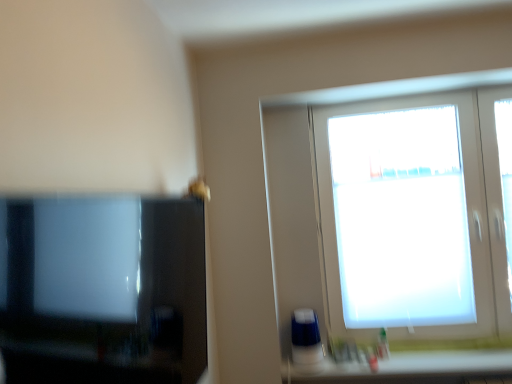
Question: Considering the positions of translucent plastic bottle at lower right and white matte window at upper right in the image, is translucent plastic bottle at lower right taller or shorter than white matte window at upper right?

Choices:
 (A) tall
 (B) short

Answer: (B)

Question: Looking at the image, does translucent plastic bottle at lower right seem bigger or smaller compared to white matte window at upper right?

Choices:
 (A) big
 (B) small

Answer: (B)

Question: Estimate the real-world distances between objects in this image. Which object is closer to the white plastic container at lower right?

Choices:
 (A) translucent plastic bottle at lower right
 (B) white matte window at upper right
 (C) matte black tv at left

Answer: (A)

Question: Estimate the real-world distances between objects in this image. Which object is farther from the white plastic container at lower right?

Choices:
 (A) matte black tv at left
 (B) white matte window at upper right
 (C) translucent plastic bottle at lower right

Answer: (A)